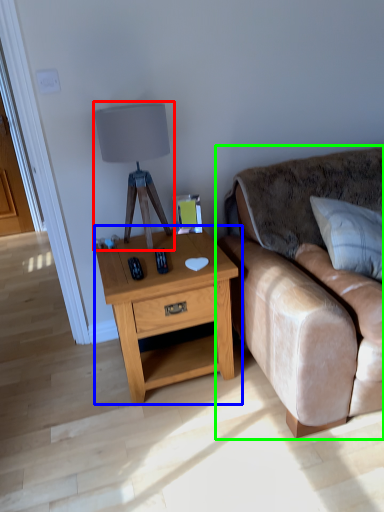
Question: Estimate the real-world distances between objects in this image. Which object is closer to table lamp (highlighted by a red box), nightstand (highlighted by a blue box) or studio couch (highlighted by a green box)?

Choices:
 (A) nightstand
 (B) studio couch

Answer: (A)